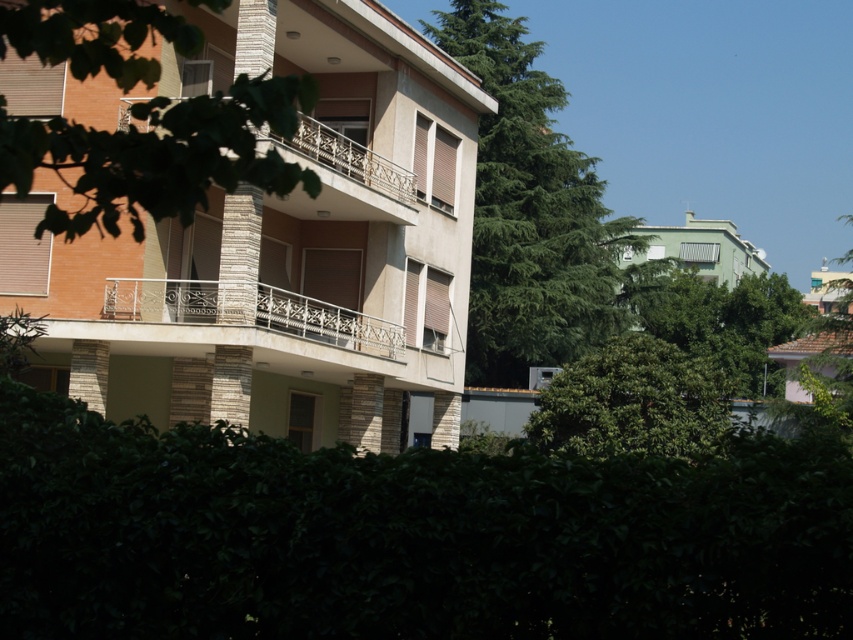
The image size is (853, 640). Describe the element at coordinates (408, 536) in the screenshot. I see `green leafy hedge at lower center` at that location.

Locate an element on the screen. This screenshot has height=640, width=853. green leafy hedge at lower center is located at coordinates (408, 536).

Between point (775, 314) and point (306, 154), which one is positioned in front?

Point (306, 154)

Looking at this image, who is taller, green leafy tree at right or stone textured balcony at center?

Standing taller between the two is green leafy tree at right.

Which is in front, point (698, 353) or point (306, 205)?

Point (306, 205)

Locate an element on the screen. The image size is (853, 640). green leafy tree at right is located at coordinates (717, 317).

Locate an element on the screen. This screenshot has height=640, width=853. green leafy hedge at lower center is located at coordinates (408, 536).